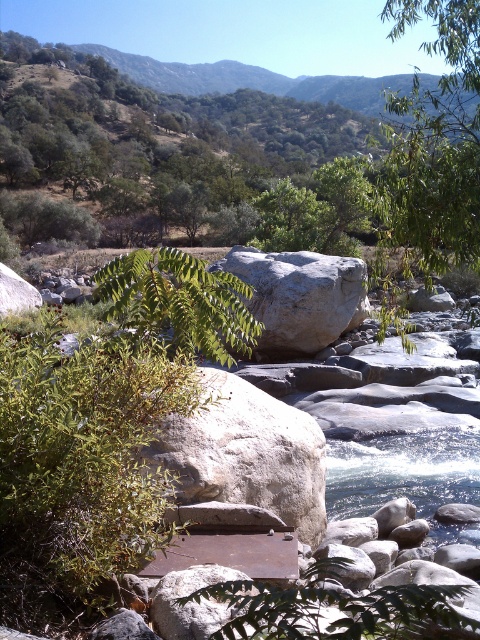
Measure the distance between clear water at river center and gray rough boulder at center.

clear water at river center is 25.06 feet away from gray rough boulder at center.

Is point (346, 461) positioned behind point (271, 282)?

That is False.

Is point (371, 481) less distant than point (256, 305)?

That is True.

This screenshot has width=480, height=640. Find the location of `clear water at river center`. clear water at river center is located at coordinates (405, 476).

Which is behind, point (227, 477) or point (472, 493)?

The point (472, 493) is more distant.

Is point (302, 435) less distant than point (442, 538)?

Yes, it is in front of point (442, 538).

The image size is (480, 640). Describe the element at coordinates (247, 452) in the screenshot. I see `gray rough rock at center` at that location.

Find the location of a particular element. This screenshot has width=480, height=640. gray rough rock at center is located at coordinates (247, 452).

Who is lower down, green leafy plant at center or gray rough boulder at center?

green leafy plant at center

Is green leafy plant at center smaller than gray rough boulder at center?

Correct, green leafy plant at center occupies less space than gray rough boulder at center.

Between point (82, 356) and point (336, 317), which one is positioned in front?

Point (82, 356) is in front.

Locate an element on the screen. green leafy plant at center is located at coordinates (101, 429).